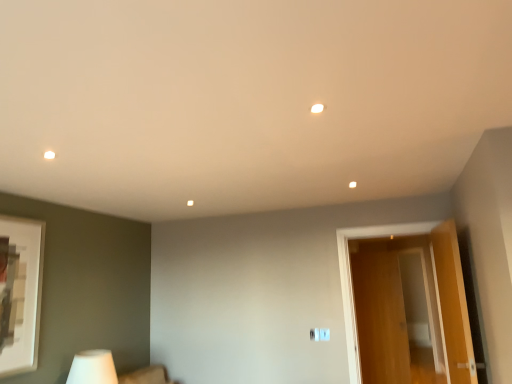
Question: Is white matte table lamp at lower left to the left or to the right of wooden door at right in the image?

Choices:
 (A) left
 (B) right

Answer: (A)

Question: Does point (97, 379) appear closer or farther from the camera than point (398, 365)?

Choices:
 (A) farther
 (B) closer

Answer: (B)

Question: Considering the positions of white matte table lamp at lower left and wooden door at right in the image, is white matte table lamp at lower left wider or thinner than wooden door at right?

Choices:
 (A) thin
 (B) wide

Answer: (B)

Question: Considering the positions of point 431,259 and point 114,382, is point 431,259 closer or farther from the camera than point 114,382?

Choices:
 (A) closer
 (B) farther

Answer: (B)

Question: Based on their positions, is wooden door at right located to the left or right of white matte table lamp at lower left?

Choices:
 (A) right
 (B) left

Answer: (A)

Question: From a real-world perspective, is wooden door at right physically located above or below white matte table lamp at lower left?

Choices:
 (A) below
 (B) above

Answer: (B)

Question: Considering the positions of wooden door at right and white matte table lamp at lower left in the image, is wooden door at right bigger or smaller than white matte table lamp at lower left?

Choices:
 (A) big
 (B) small

Answer: (A)